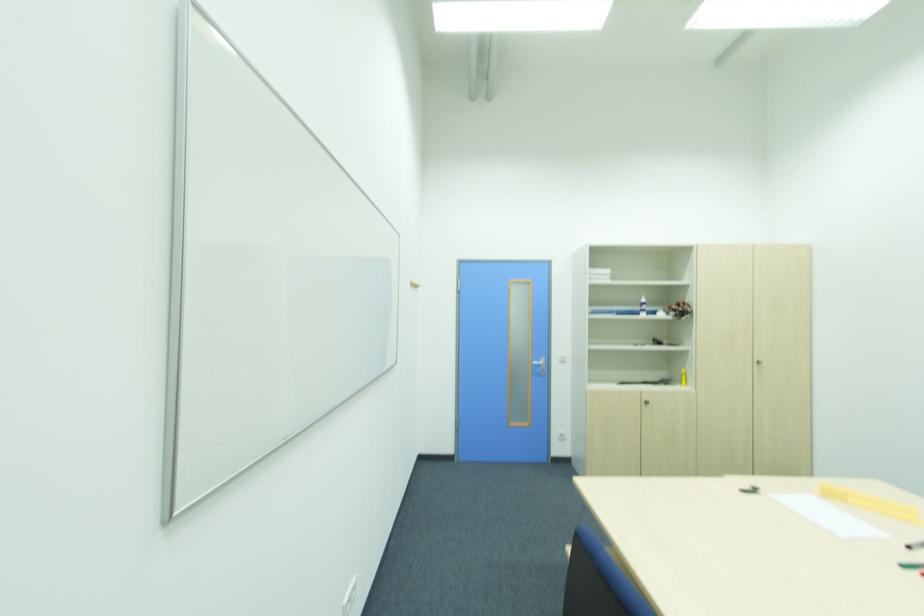
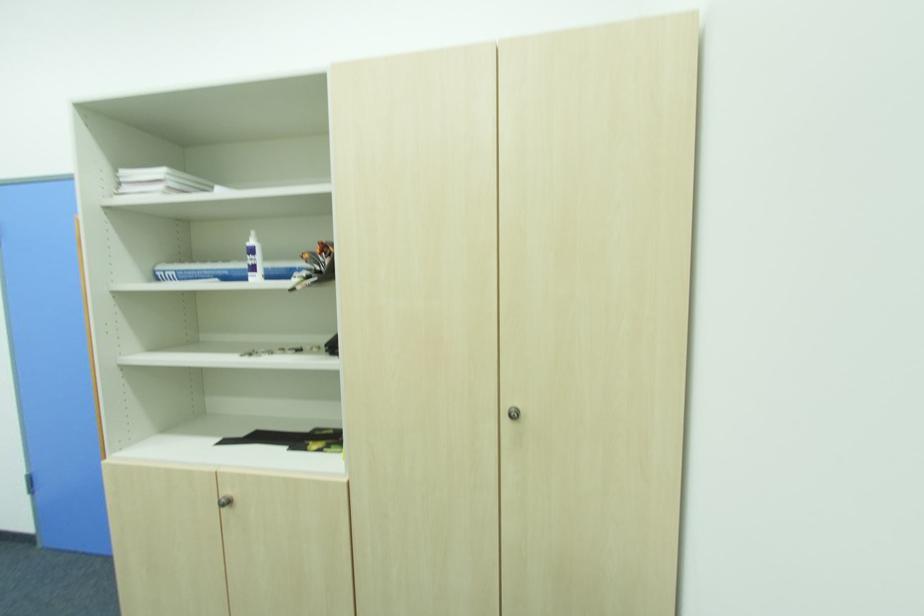
Where in the second image is the point corresponding to point (611, 273) from the first image?

(161, 172)